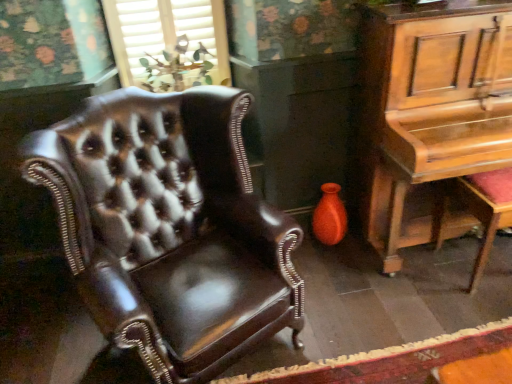
At what (x,y) coordinates should I click in order to perform the action: click on vacant space to the right of shiny brown leather armchair at left. Please return your answer as a coordinate pair (x, y). Looking at the image, I should click on (350, 319).